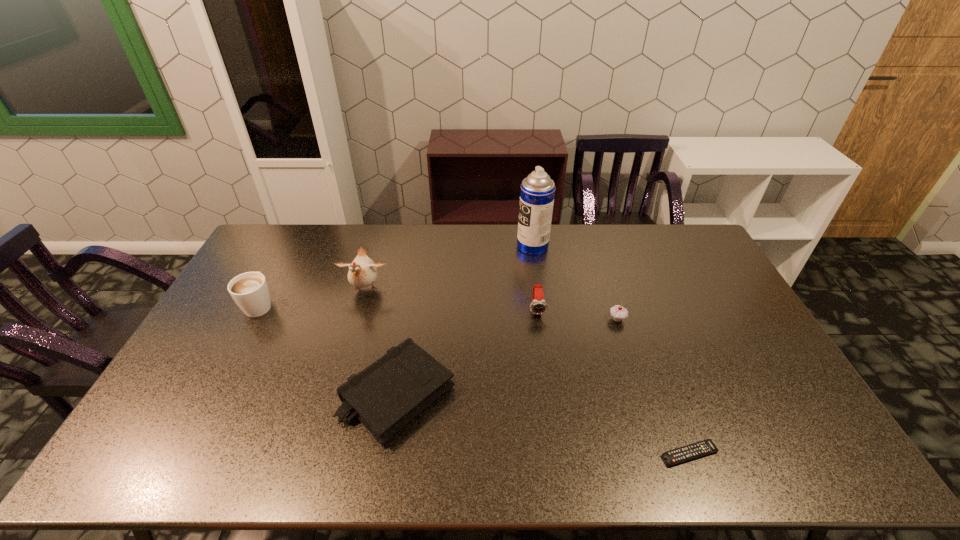
At what (x,y) coordinates should I click in order to perform the action: click on vacant space at the far right corner. Please return your answer as a coordinate pair (x, y). The width and height of the screenshot is (960, 540). Looking at the image, I should click on (679, 248).

Identify the location of free space between the remote control and the Bible. Image resolution: width=960 pixels, height=540 pixels. (543, 424).

Identify the location of unoccupied position between the cupcake and the cappuccino. The height and width of the screenshot is (540, 960). (439, 312).

I want to click on free spot between the cupcake and the cappuccino, so click(x=439, y=312).

Image resolution: width=960 pixels, height=540 pixels. Identify the location of free spot between the Bible and the third tallest object. (328, 349).

Find the location of `vacant area that lies between the remote control and the cupcake`. vacant area that lies between the remote control and the cupcake is located at coordinates (654, 387).

At what (x,y) coordinates should I click in order to perform the action: click on vacant area that lies between the watch and the shortest object. Please return your answer as a coordinate pair (x, y). The image size is (960, 540). Looking at the image, I should click on (613, 382).

You are a GUI agent. You are given a task and a screenshot of the screen. Output one action in this format:
    pyautogui.click(x=<x>, y=<y>)
    Task: Click on the vacant space in between the shortest object and the farthest object
    This screenshot has height=540, width=960.
    Given the screenshot: What is the action you would take?
    pyautogui.click(x=612, y=350)

You are a GUI agent. You are given a task and a screenshot of the screen. Output one action in this format:
    pyautogui.click(x=<x>, y=<y>)
    Task: Click on the vacant region between the watch and the shortest object
    
    Given the screenshot: What is the action you would take?
    pyautogui.click(x=613, y=382)

Where is `empty space between the watch and the fifth shortest object`? empty space between the watch and the fifth shortest object is located at coordinates (398, 307).